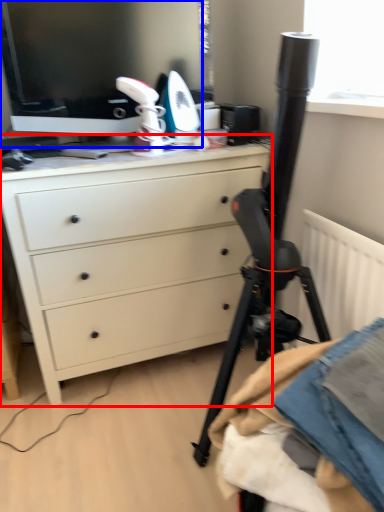
Question: Which point is further to the camera, chest of drawers (highlighted by a red box) or computer monitor (highlighted by a blue box)?

Choices:
 (A) chest of drawers
 (B) computer monitor

Answer: (B)